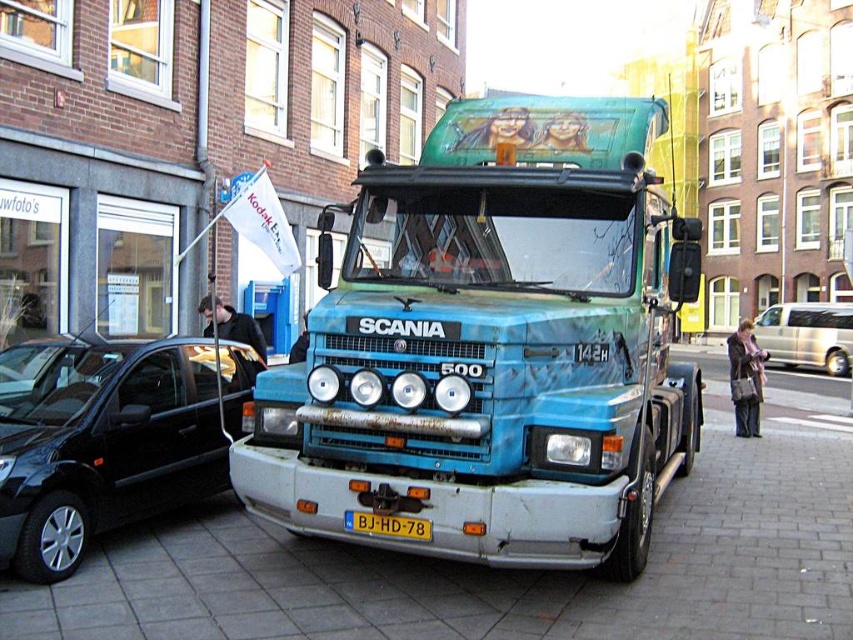
You are a delivery driver who needs to park your truck between the metallic silver van at right and the yellow plastic license plate at center. Can you fit your truck in the space between them?

The metallic silver van at right is narrower than the yellow plastic license plate at center, but since the license plate is a fixed object and not a vehicle, the space between them might not be sufficient for parking your truck. Please check the actual distance between the van and the license plate before deciding to park.

You are a photographer standing in front of the blue metallic truck at center and the shiny black car at left. You want to capture a photo where both vehicles are visible. Which vehicle should you position closer to the camera to ensure both are fully visible in the frame?

You should position the shiny black car at left closer to the camera because the blue metallic truck at center is taller than the shiny black car at left. By placing the shorter vehicle closer, you can adjust the angle to include both vehicles in the frame without one blocking the other.